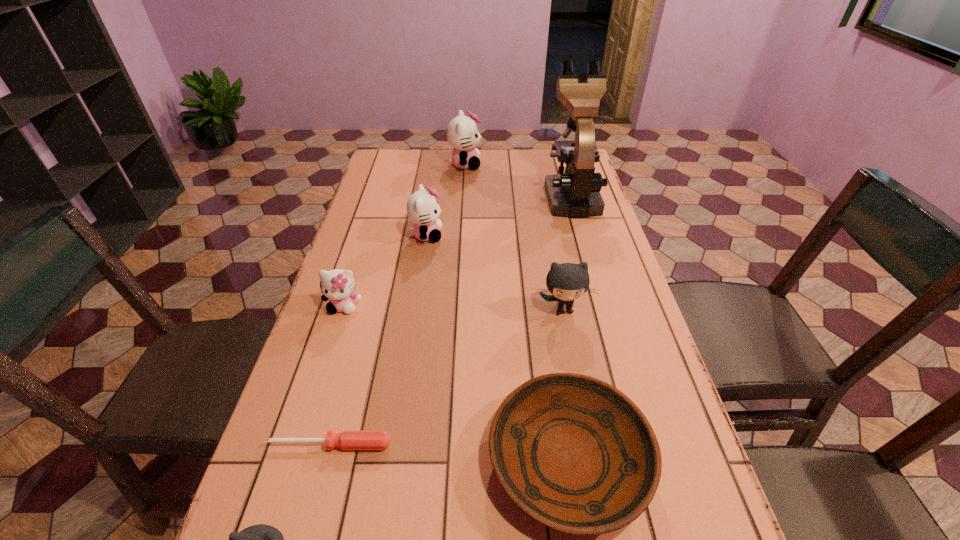
Where is `screwdriver at the left edge`? The width and height of the screenshot is (960, 540). screwdriver at the left edge is located at coordinates (349, 439).

The width and height of the screenshot is (960, 540). What are the coordinates of `microscope located at the right edge` in the screenshot? It's located at (575, 193).

The height and width of the screenshot is (540, 960). Find the location of `kitten located in the right edge section of the desktop`. kitten located in the right edge section of the desktop is located at coordinates (567, 281).

Identify the location of object located at the far right corner. The height and width of the screenshot is (540, 960). (575, 193).

In the image, there is a desktop. Where is `vacant space at the far edge`? vacant space at the far edge is located at coordinates (420, 167).

You are a GUI agent. You are given a task and a screenshot of the screen. Output one action in this format:
    pyautogui.click(x=<x>, y=<y>)
    Task: Click on the vacant space at the left edge
    The height and width of the screenshot is (540, 960).
    Given the screenshot: What is the action you would take?
    pyautogui.click(x=363, y=279)

In the image, there is a desktop. At what (x,y) coordinates should I click in order to perform the action: click on free region at the right edge. Please return your answer as a coordinate pair (x, y). This screenshot has width=960, height=540. Looking at the image, I should click on (572, 247).

This screenshot has height=540, width=960. In the image, there is a desktop. In order to click on vacant space at the far left corner in this screenshot , I will do `click(413, 166)`.

You are a GUI agent. You are given a task and a screenshot of the screen. Output one action in this format:
    pyautogui.click(x=<x>, y=<y>)
    Task: Click on the vacant area at the far right corner
    This screenshot has height=540, width=960.
    Given the screenshot: What is the action you would take?
    pyautogui.click(x=555, y=165)

This screenshot has width=960, height=540. I want to click on vacant space in between the fourth nearest kitten and the microscope, so click(x=498, y=215).